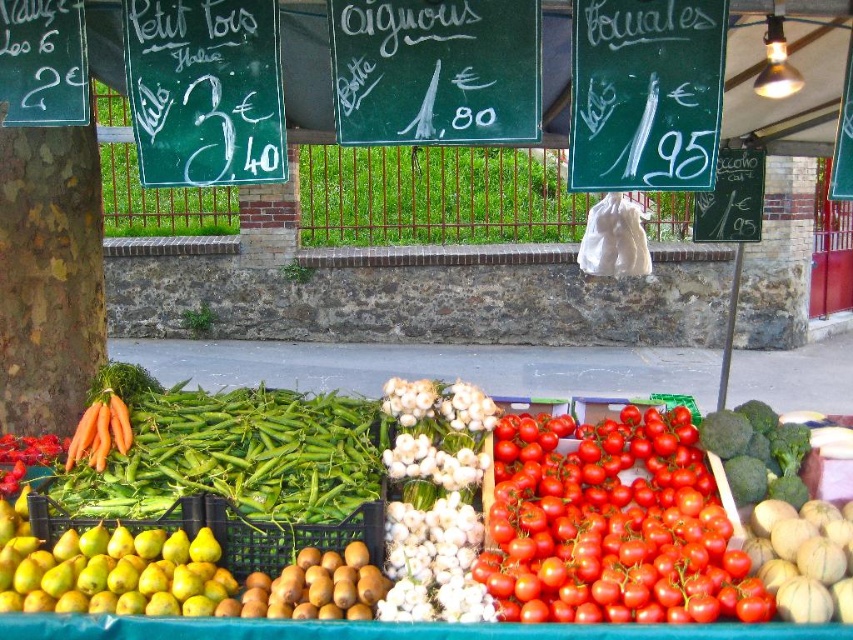
Question: Based on their relative distances, which object is farther from the orange smooth carrot at left?

Choices:
 (A) green chalkboard sign at center
 (B) yellow matte pears at lower left

Answer: (A)

Question: Does green chalkboard sign at center appear under green chalkboard sign at upper right?

Choices:
 (A) yes
 (B) no

Answer: (B)

Question: Does green chalkboard sign at upper right have a greater width compared to smooth melon at center?

Choices:
 (A) no
 (B) yes

Answer: (A)

Question: Considering the real-world distances, which object is closest to the green broccoli at center?

Choices:
 (A) green chalkboard sign at upper right
 (B) orange matte carrots at left
 (C) green chalkboard at upper left

Answer: (A)

Question: Does green chalkboard sign at center have a smaller size compared to green chalkboard at upper left?

Choices:
 (A) no
 (B) yes

Answer: (B)

Question: Which of the following is the closest to the observer?

Choices:
 (A) (621, 604)
 (B) (196, 74)
 (C) (752, 440)

Answer: (B)